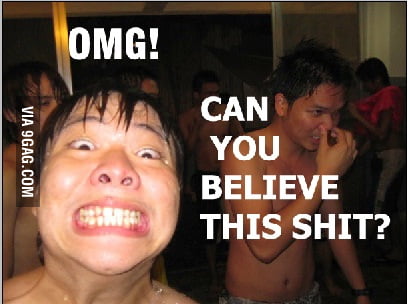
Where is `window framw`? window framw is located at coordinates (62, 28), (279, 28), (361, 30).